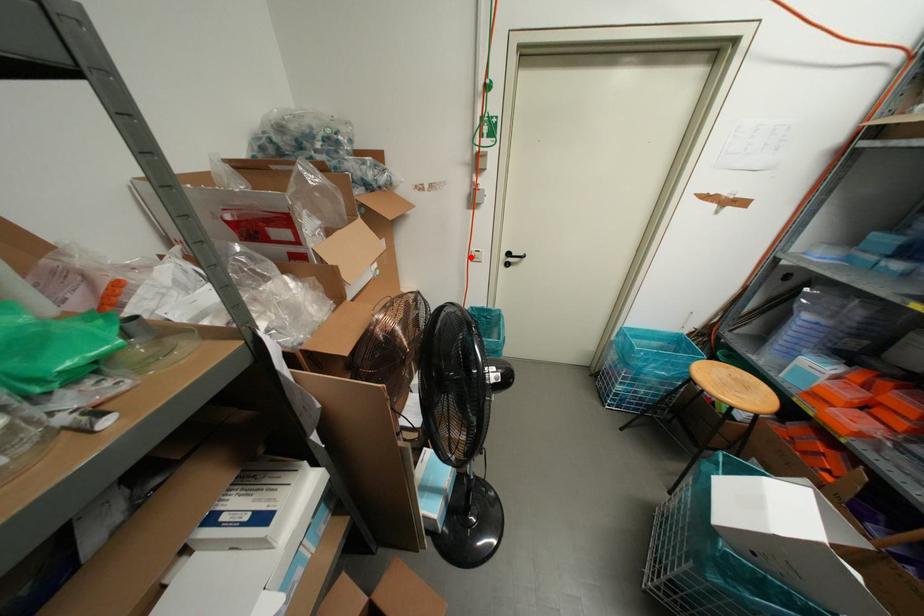
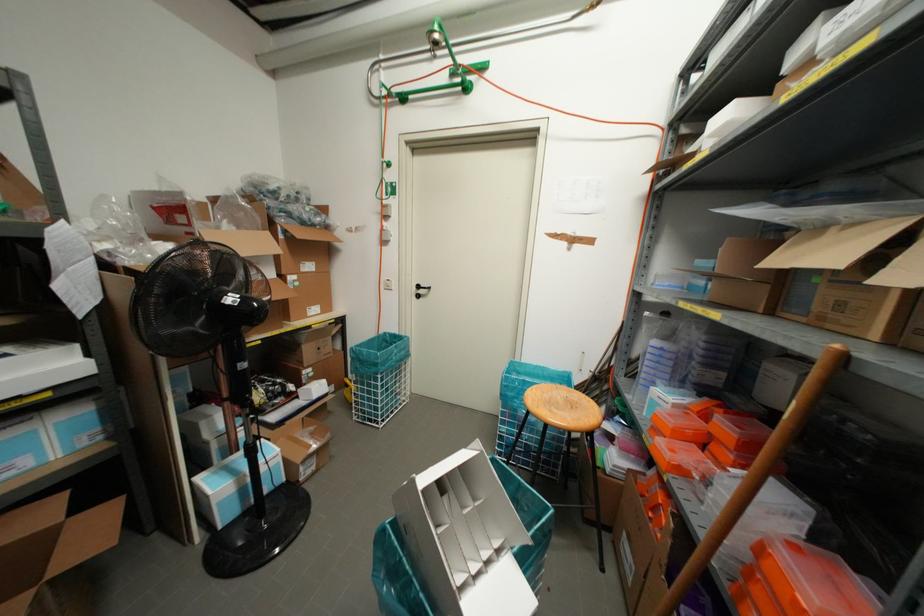
Find the pixel in the second image that matches the highlighted location in the first image.

(382, 285)